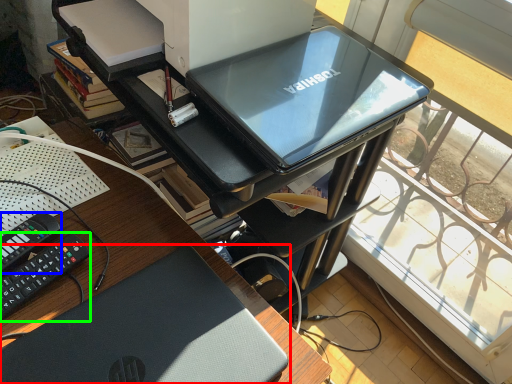
Question: Which is nearer to the laptop (highlighted by a red box)? equipment (highlighted by a blue box) or equipment (highlighted by a green box).

Choices:
 (A) equipment
 (B) equipment

Answer: (B)